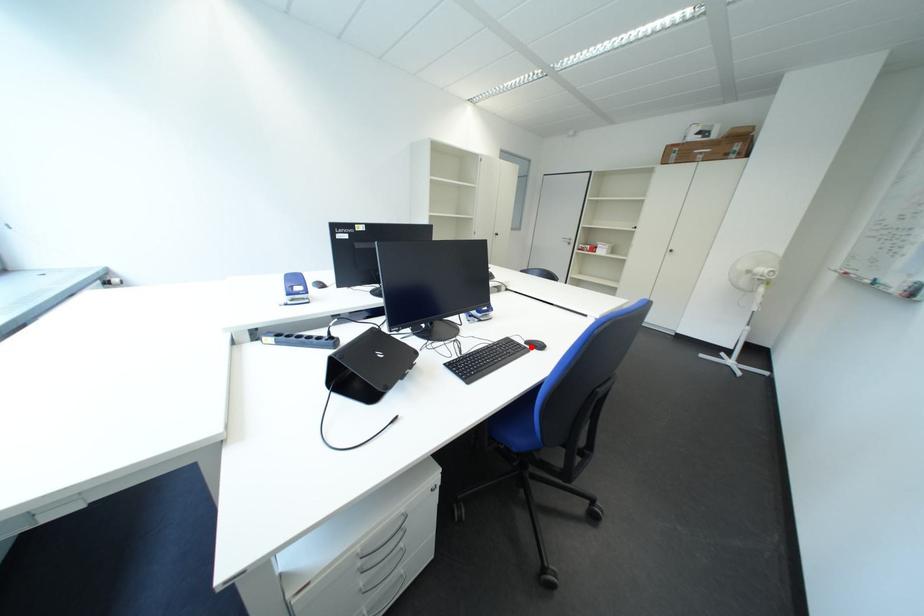
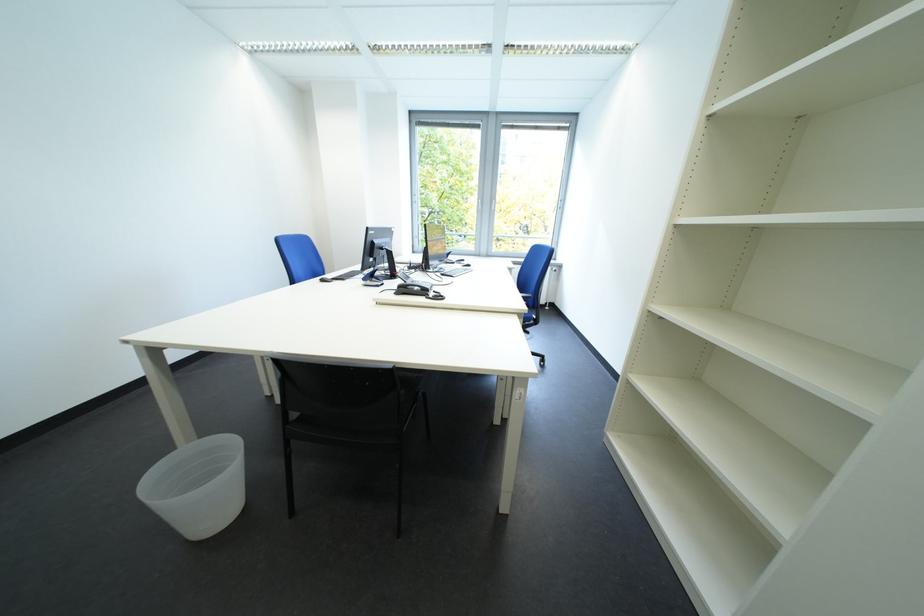
Question: I am providing you with two images of the same scene from different viewpoints. A red point is marked on the first image. At the location where the point appears in image 1, is it still visible in image 2?

Choices:
 (A) Yes
 (B) No

Answer: (B)